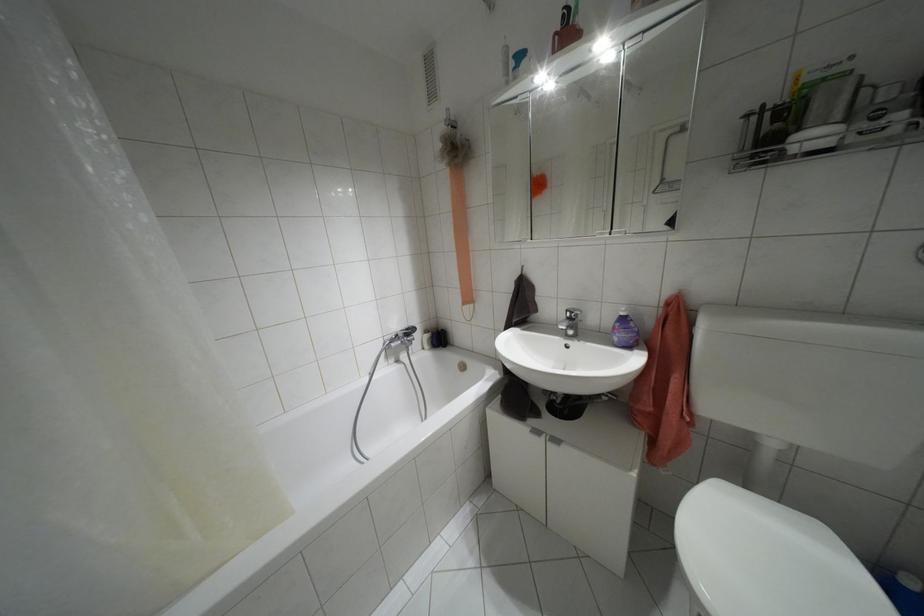
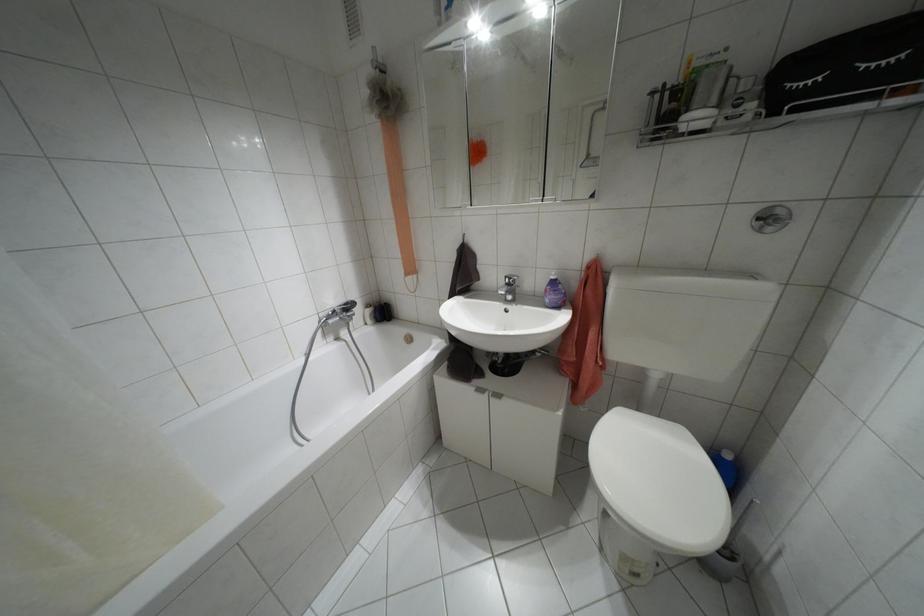
Question: The camera is either moving clockwise (left) or counter-clockwise (right) around the object. The first image is from the beginning of the video and the second image is from the end. Is the camera moving left or right when shooting the video?

Choices:
 (A) Left
 (B) Right

Answer: (A)